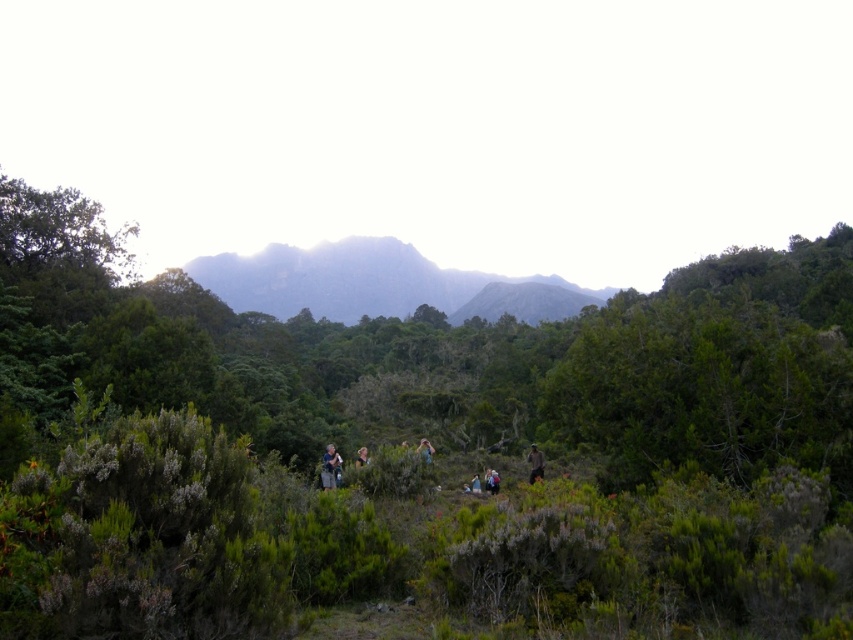
Between green leafy tree at upper left and light brown fabric jacket at lower center, which one is positioned lower?

Positioned lower is light brown fabric jacket at lower center.

Looking at this image, which of these two, green leafy tree at upper left or light brown fabric jacket at lower center, stands taller?

green leafy tree at upper left

Is point (36, 188) positioned after point (340, 465)?

Yes, it is.

Where is `green leafy tree at upper left`? green leafy tree at upper left is located at coordinates (59, 230).

Is point (488, 470) closer to camera compared to point (358, 456)?

Yes, point (488, 470) is in front of point (358, 456).

Can you confirm if blue fabric backpack at center is smaller than light brown hair at center?

Yes.

Between point (488, 477) and point (355, 460), which one is positioned behind?

Positioned behind is point (355, 460).

I want to click on blue fabric backpack at center, so click(x=491, y=481).

Between point (112, 250) and point (531, 470), which one is positioned in front?

Point (531, 470) is in front.

Where is `green leafy tree at upper left`? The image size is (853, 640). green leafy tree at upper left is located at coordinates (59, 230).

At what (x,y) coordinates should I click in order to perform the action: click on green leafy tree at upper left. Please return your answer as a coordinate pair (x, y). The width and height of the screenshot is (853, 640). Looking at the image, I should click on pyautogui.click(x=59, y=230).

Find the location of a particular element. This screenshot has width=853, height=640. green leafy tree at upper left is located at coordinates (59, 230).